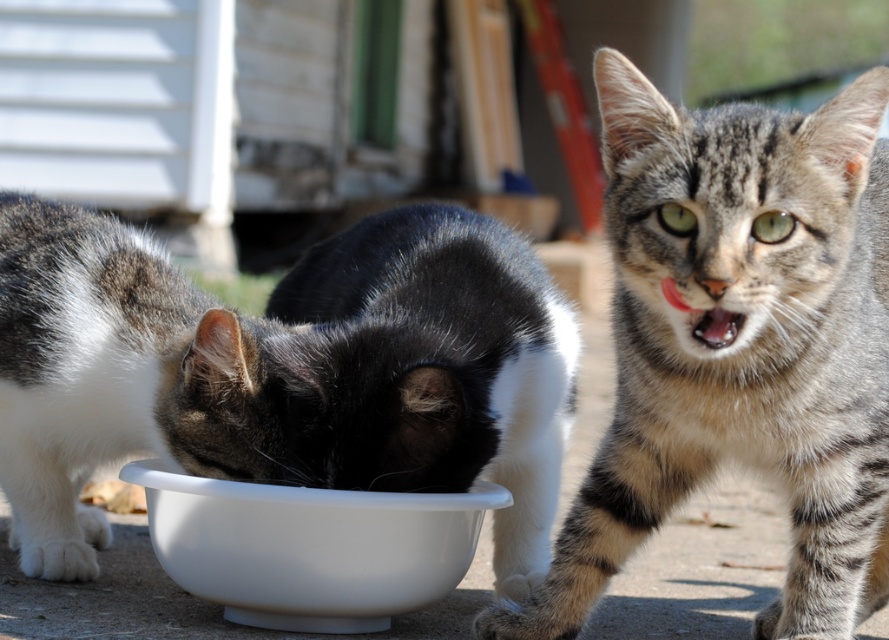
Is point (357, 269) behind point (757, 275)?

Yes, point (357, 269) is behind point (757, 275).

Is gray tabby cat at center positioned in front of tabby fur cat at center?

No.

This screenshot has height=640, width=889. Find the location of `gray tabby cat at center`. gray tabby cat at center is located at coordinates (287, 372).

Can you confirm if gray tabby cat at center is positioned to the left of white glossy bowl at center?

Yes, gray tabby cat at center is to the left of white glossy bowl at center.

Is gray tabby cat at center wider than white glossy bowl at center?

Indeed, gray tabby cat at center has a greater width compared to white glossy bowl at center.

Based on the photo, who is more forward, (562,422) or (291,579)?

Point (291,579) is in front.

You are a GUI agent. You are given a task and a screenshot of the screen. Output one action in this format:
    pyautogui.click(x=<x>, y=<y>)
    Task: Click on the gray tabby cat at center
    The width and height of the screenshot is (889, 640).
    Given the screenshot: What is the action you would take?
    pyautogui.click(x=287, y=372)

Does tabby fur cat at center have a greater height compared to white glossy bowl at center?

Yes, tabby fur cat at center is taller than white glossy bowl at center.

Between tabby fur cat at center and white glossy bowl at center, which one is positioned lower?

Positioned lower is white glossy bowl at center.

This screenshot has height=640, width=889. Identify the location of tabby fur cat at center. [x=738, y=344].